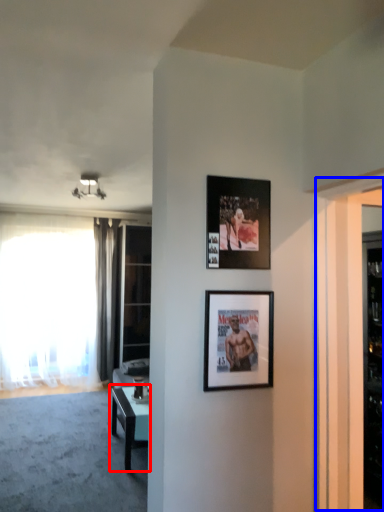
Question: Which object appears farthest to the camera in this image, table (highlighted by a red box) or screen door (highlighted by a blue box)?

Choices:
 (A) table
 (B) screen door

Answer: (A)